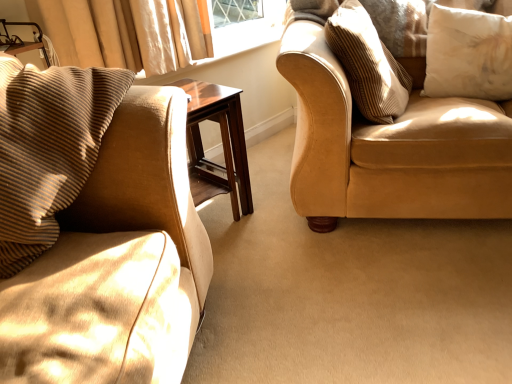
Question: Should I look upward or downward to see brown corduroy pillow at left, which is the 1th pillow from left to right?

Choices:
 (A) up
 (B) down

Answer: (A)

Question: Is mahogany wood side table at center at the right side of striped fabric pillow at upper right, acting as the 2th pillow starting from the right?

Choices:
 (A) no
 (B) yes

Answer: (A)

Question: Considering the relative sizes of mahogany wood side table at center and striped fabric pillow at upper right, the second pillow viewed from the left, in the image provided, is mahogany wood side table at center bigger than striped fabric pillow at upper right, the second pillow viewed from the left,?

Choices:
 (A) yes
 (B) no

Answer: (B)

Question: From the image's perspective, is mahogany wood side table at center above striped fabric pillow at upper right, the second pillow viewed from the left?

Choices:
 (A) yes
 (B) no

Answer: (B)

Question: Considering the relative positions of mahogany wood side table at center and striped fabric pillow at upper right, the second pillow viewed from the left, in the image provided, is mahogany wood side table at center behind striped fabric pillow at upper right, the second pillow viewed from the left,?

Choices:
 (A) yes
 (B) no

Answer: (A)

Question: Can you confirm if mahogany wood side table at center is positioned to the left of striped fabric pillow at upper right, acting as the 2th pillow starting from the right?

Choices:
 (A) yes
 (B) no

Answer: (A)

Question: Would you consider mahogany wood side table at center to be distant from striped fabric pillow at upper right, acting as the 2th pillow starting from the right?

Choices:
 (A) yes
 (B) no

Answer: (B)

Question: From the image's perspective, would you say mahogany wood side table at center is positioned over white soft cushion at upper right, which ranks as the third pillow in left-to-right order?

Choices:
 (A) no
 (B) yes

Answer: (A)

Question: From a real-world perspective, is mahogany wood side table at center physically above white soft cushion at upper right, the first pillow from the right?

Choices:
 (A) no
 (B) yes

Answer: (A)

Question: Is mahogany wood side table at center further to the viewer compared to white soft cushion at upper right, which ranks as the third pillow in left-to-right order?

Choices:
 (A) yes
 (B) no

Answer: (B)

Question: Is white soft cushion at upper right, which ranks as the third pillow in left-to-right order, located within mahogany wood side table at center?

Choices:
 (A) yes
 (B) no

Answer: (B)

Question: From the image's perspective, is mahogany wood side table at center beneath white soft cushion at upper right, which ranks as the third pillow in left-to-right order?

Choices:
 (A) yes
 (B) no

Answer: (A)

Question: Can you confirm if mahogany wood side table at center is wider than white soft cushion at upper right, which ranks as the third pillow in left-to-right order?

Choices:
 (A) yes
 (B) no

Answer: (A)

Question: Is striped fabric pillow at upper right, acting as the 2th pillow starting from the right, wider than white soft cushion at upper right, which ranks as the third pillow in left-to-right order?

Choices:
 (A) no
 (B) yes

Answer: (B)